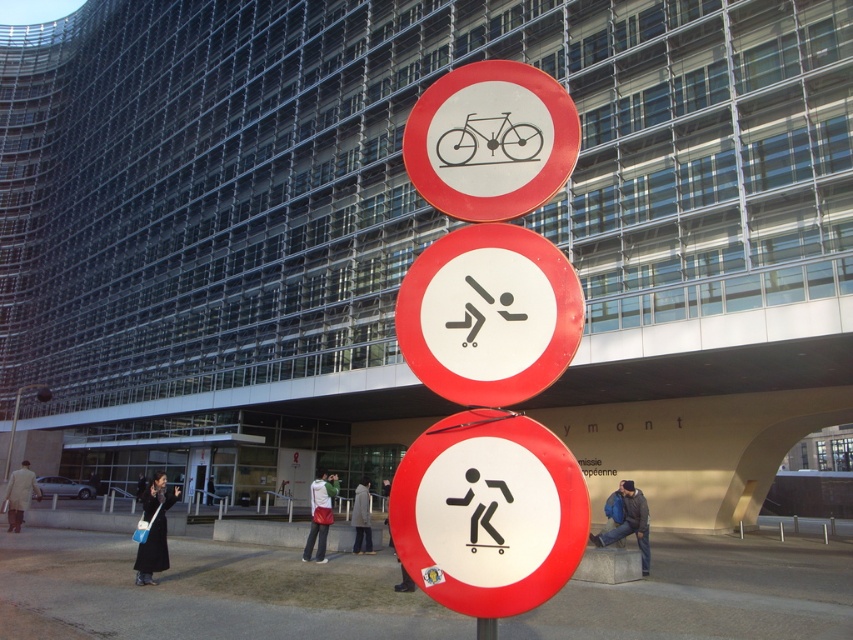
Question: Observing the image, what is the correct spatial positioning of white paper sign at center in reference to black fabric coat at lower left?

Choices:
 (A) right
 (B) left

Answer: (A)

Question: Which of the following is the farthest from the observer?

Choices:
 (A) white paper figure at center
 (B) blue denim jacket at lower right

Answer: (B)

Question: Does blue denim jacket at lower right have a larger size compared to metallic pole at center?

Choices:
 (A) yes
 (B) no

Answer: (A)

Question: Which of the following is the closest to the observer?

Choices:
 (A) light beige coat at lower left
 (B) white matte bicycle at upper center

Answer: (B)

Question: Which point is farther from the camera taking this photo?

Choices:
 (A) (396, 496)
 (B) (630, 518)
 (C) (399, 314)

Answer: (B)

Question: Is light beige coat at lower left above light gray coat at center?

Choices:
 (A) no
 (B) yes

Answer: (A)